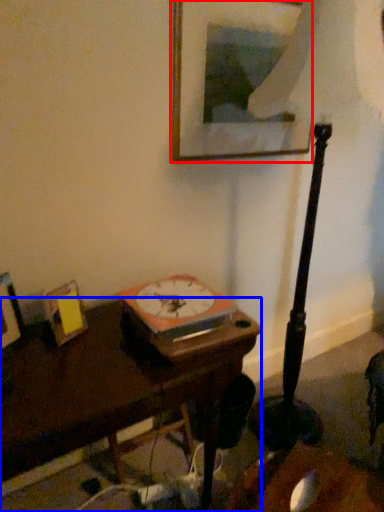
Question: Which of the following is the closest to the observer, picture frame (highlighted by a red box) or table (highlighted by a blue box)?

Choices:
 (A) picture frame
 (B) table

Answer: (B)